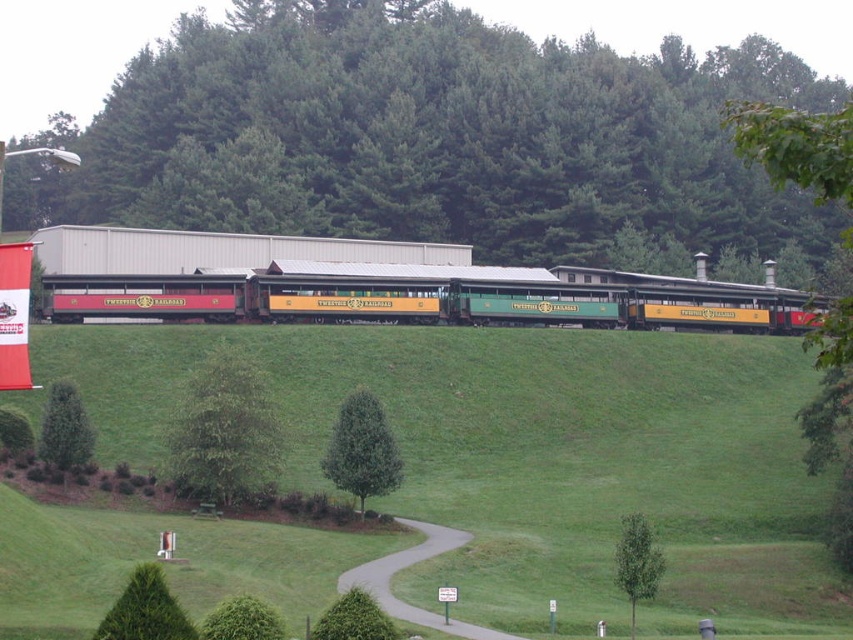
Which of these two, green leafy tree at center or green leafy tree at lower right, stands taller?

With more height is green leafy tree at center.

Is point (219, 410) closer to camera compared to point (654, 556)?

No, it is behind (654, 556).

Identify the location of green leafy tree at center. (223, 433).

Measure the distance between point (144, 625) and camera.

Point (144, 625) is 22.41 meters away from camera.

Is green textured tree at lower left smaller than green leafy tree at lower left?

Yes, green textured tree at lower left is smaller than green leafy tree at lower left.

Does point (123, 618) come in front of point (73, 444)?

Yes, it is in front of point (73, 444).

Where is `green textured tree at lower left`? green textured tree at lower left is located at coordinates (144, 609).

Can you confirm if green leafy tree at upper center is positioned above green leafy tree at center?

Yes, green leafy tree at upper center is above green leafy tree at center.

Is green leafy tree at upper center to the right of green leafy tree at center from the viewer's perspective?

Correct, you'll find green leafy tree at upper center to the right of green leafy tree at center.

Who is more distant from viewer, (451, 218) or (245, 490)?

The point (451, 218) is behind.

Locate an element on the screen. The height and width of the screenshot is (640, 853). green leafy tree at upper center is located at coordinates (436, 140).